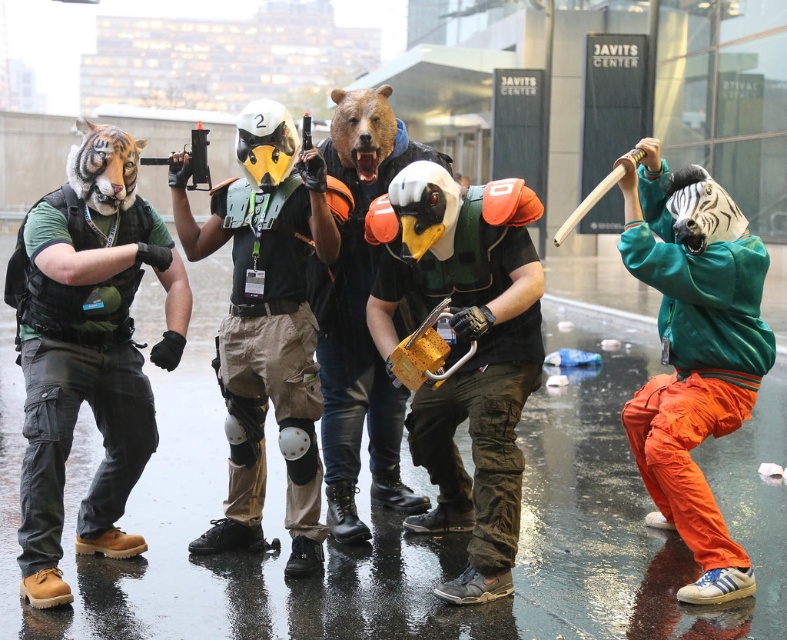
Consider the image. You are a photographer trying to capture a clear shot of both the velvet green hoodie at right and the brown matte bear mask at center. Given their sizes, which object should you zoom in on more to ensure both are visible in the frame?

The velvet green hoodie at right is larger in size than the brown matte bear mask at center, so you should zoom in more on the brown matte bear mask at center to balance their sizes in the frame.

You are standing in the rainy urban setting at the Javits Center. You see a matte green helmet at center. Can you reach it without moving more than 5 meters?

The matte green helmet at center is 5.29 meters away from viewer, so you cannot reach it without moving more than 5 meters.

You are standing in front of the group of individuals in the image. You notice two helmets at the center of the scene. Which helmet is positioned to the right when looking at the matte green helmet at center and the matte black helmet at center?

The matte green helmet at center is to the right of the matte black helmet at center.